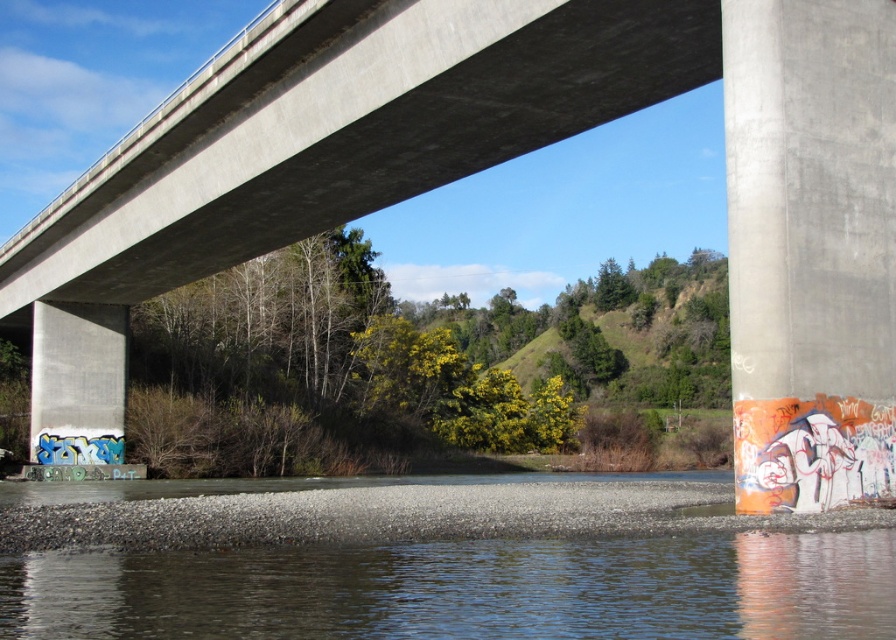
Question: In this image, where is concrete pillar at right located relative to concrete/rough pillar at lower left?

Choices:
 (A) right
 (B) left

Answer: (A)

Question: Which object is the closest to the concrete pillar at right?

Choices:
 (A) clear water at bottom
 (B) concrete/rough pillar at lower left

Answer: (A)

Question: Observing the image, what is the correct spatial positioning of clear water at bottom in reference to concrete/rough pillar at lower left?

Choices:
 (A) left
 (B) right

Answer: (B)

Question: Does clear water at bottom appear under concrete pillar at right?

Choices:
 (A) yes
 (B) no

Answer: (A)

Question: Estimate the real-world distances between objects in this image. Which object is farther from the concrete/rough pillar at lower left?

Choices:
 (A) concrete pillar at right
 (B) clear water at bottom

Answer: (B)

Question: Which of the following is the farthest from the observer?

Choices:
 (A) (45, 461)
 (B) (571, 584)
 (C) (840, 333)

Answer: (A)